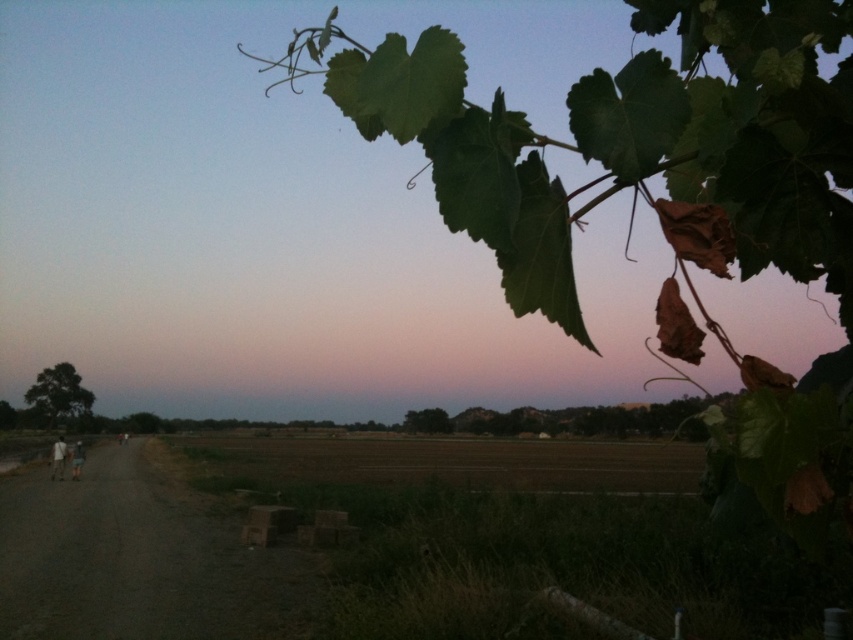
You are standing at the edge of the scene and want to walk towards the brown soil at center. Which direction should you head relative to the dark brown dirt track at lower left?

You should head to the right of the dark brown dirt track at lower left because the brown soil at center is located to the right of it.

You are a photographer trying to capture the entire scene in one shot. Given that the brown soil at center and the white fabric person at lower left must both be visible, which object will occupy more of the frame?

The brown soil at center will occupy more of the frame because it is larger in size than the white fabric person at lower left according to the description.

You are standing in the rural scene shown in the image. You need to locate the light brown fabric pants at left. Based on their coordinates, where exactly would you find them?

The light brown fabric pants at left are located at coordinates point (57, 458).